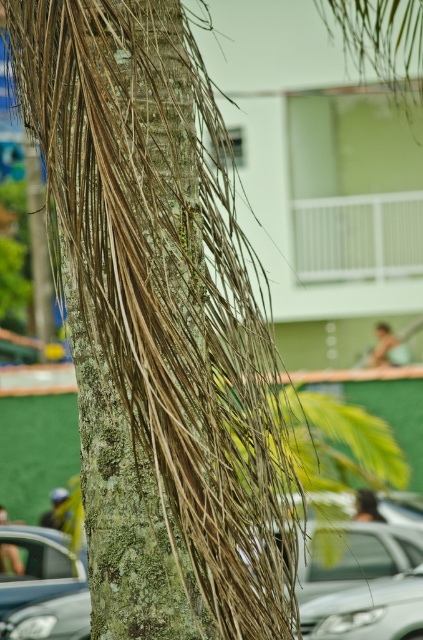
Can you confirm if lichen-covered bark at center is positioned to the left of sleek silver sedan at lower center?

Correct, you'll find lichen-covered bark at center to the left of sleek silver sedan at lower center.

Is point (132, 538) behind point (313, 600)?

No, (132, 538) is in front of (313, 600).

I want to click on lichen-covered bark at center, so click(123, 509).

Which is more to the left, lichen-covered bark at center or metallic silver car at lower left?

From the viewer's perspective, metallic silver car at lower left appears more on the left side.

Is lichen-covered bark at center below metallic silver car at lower left?

No.

Is point (88, 422) farther from viewer compared to point (14, 561)?

No.

Find the location of a particular element. Image resolution: width=423 pixels, height=640 pixels. lichen-covered bark at center is located at coordinates (123, 509).

Can you confirm if metallic silver car at lower left is shorter than sleek silver sedan at lower center?

Incorrect, metallic silver car at lower left's height does not fall short of sleek silver sedan at lower center's.

You are a GUI agent. You are given a task and a screenshot of the screen. Output one action in this format:
    pyautogui.click(x=<x>, y=<y>)
    Task: Click on the metallic silver car at lower left
    The height and width of the screenshot is (640, 423).
    Given the screenshot: What is the action you would take?
    pyautogui.click(x=41, y=586)